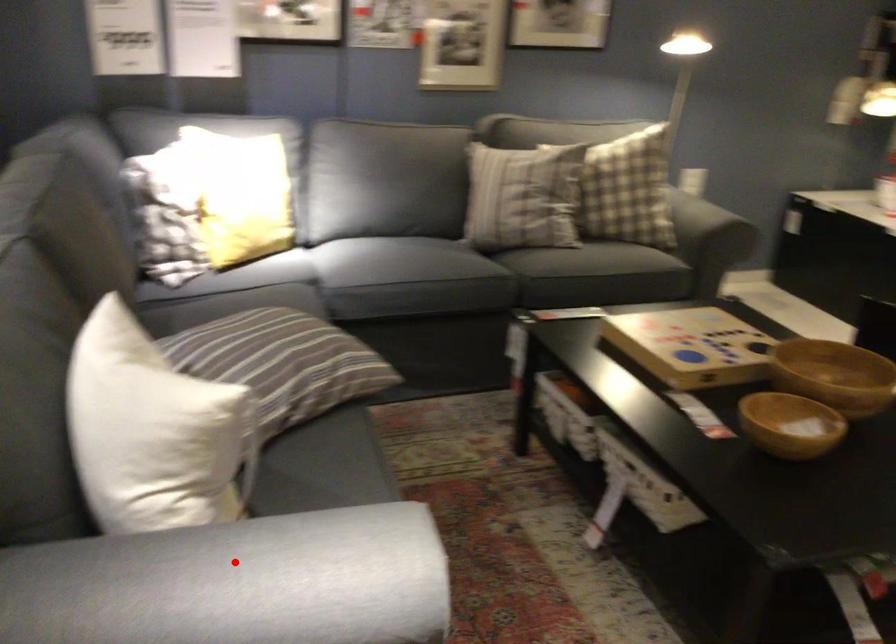
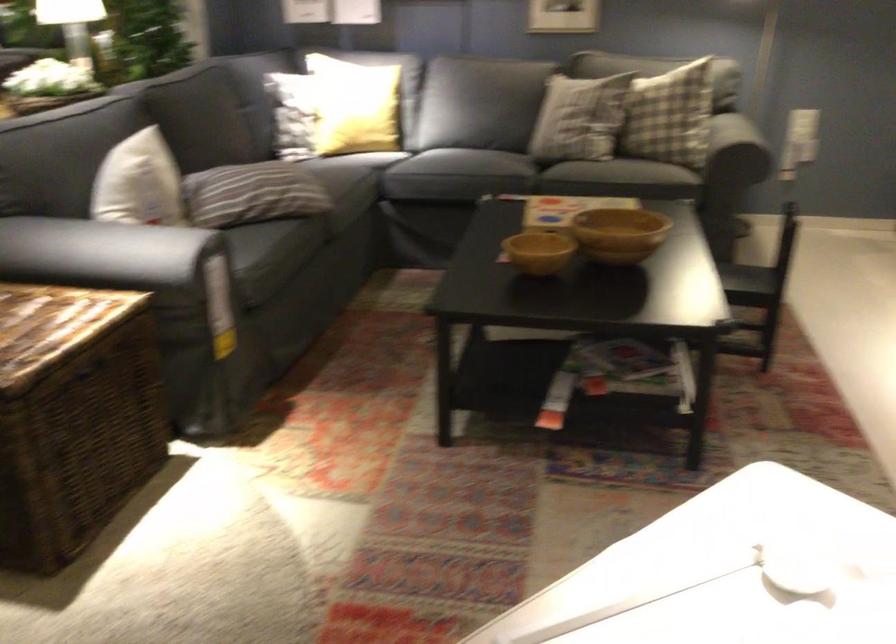
Question: I am providing you with two images of the same scene from different viewpoints. Image1 has a red point marked. In image2, the corresponding 3D location appears at what relative position? Reply with the corresponding letter.

Choices:
 (A) Closer
 (B) Farther

Answer: (B)